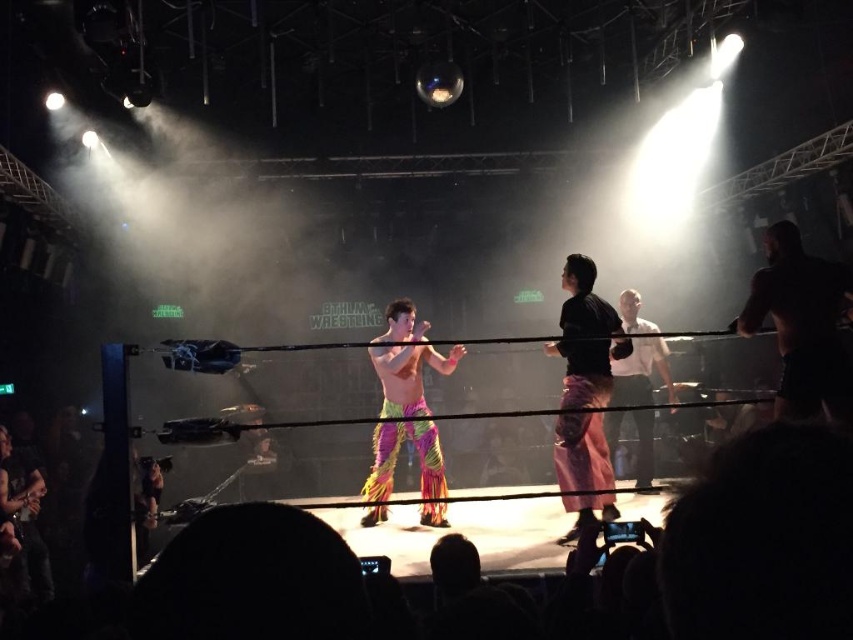
You are a photographer positioned at the edge of the arena. You need to capture a photo where both the black matte shirt at center and the white shirt at center are visible. Given their positions, which shirt will appear wider in the photo?

The white shirt at center will appear wider in the photo because the black matte shirt at center has a lesser width compared to it.

In the scene shown: You are a photographer at the wrestling match. You need to capture a closeup shot of both the black matte shirt at center and the multicolored fabric pants at center. Which object should you focus on first to ensure it appears sharp in the photo?

The black matte shirt at center is smaller than the multicolored fabric pants at center, so you should focus on the black matte shirt at center first because smaller objects require precise focusing to ensure sharpness.

You are a photographer in the front row of the wrestling match. You want to take a closeup shot of the black matte shirt at center. Based on its position, which direction should you move to get it centered in your viewfinder?

The black matte shirt at center is located at point (585,337). To center it in your viewfinder, you should move slightly to the right and up since the coordinates are offset from the center of the frame.